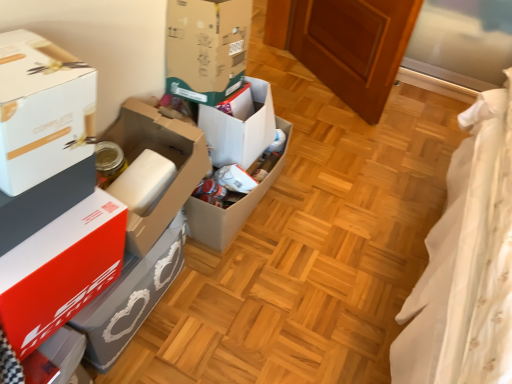
The height and width of the screenshot is (384, 512). What are the coordinates of `cardboard box at center, the 4th box from the front` in the screenshot? It's located at (206, 48).

Find the location of a particular element. This screenshot has width=512, height=384. white cardboard box at left, the sixth box from the back is located at coordinates (42, 110).

This screenshot has width=512, height=384. Describe the element at coordinates (42, 110) in the screenshot. I see `white cardboard box at left, the sixth box from the back` at that location.

Describe the element at coordinates (225, 214) in the screenshot. I see `cardboard box at center, the fifth box when ordered from front to back` at that location.

At what (x,y) coordinates should I click in order to perform the action: click on white cardboard box at left, which is the 4th box from back to front. Please return your answer as a coordinate pair (x, y). This screenshot has height=384, width=512. Looking at the image, I should click on (166, 157).

Between red matte box at left, the second box in the front-to-back sequence, and white cardboard box at left, which is the 4th box from back to front, which one is positioned behind?

white cardboard box at left, which is the 4th box from back to front, is behind.

In the scene shown: Is red matte box at left, arranged as the 5th box when viewed from the back, facing towards white cardboard box at left, positioned as the 3th box in front-to-back order?

No, red matte box at left, arranged as the 5th box when viewed from the back, is not aimed at white cardboard box at left, positioned as the 3th box in front-to-back order.

Which of these two, red matte box at left, arranged as the 5th box when viewed from the back, or white cardboard box at left, positioned as the 3th box in front-to-back order, stands taller?

red matte box at left, arranged as the 5th box when viewed from the back, is taller.

Are red matte box at left, the second box in the front-to-back sequence, and white cardboard box at left, positioned as the 3th box in front-to-back order, making contact?

No, red matte box at left, the second box in the front-to-back sequence, is not making contact with white cardboard box at left, positioned as the 3th box in front-to-back order.

Which is behind, cardboard box at center, the fifth box when ordered from front to back, or white cardboard box at left, positioned as the 3th box in front-to-back order?

cardboard box at center, the fifth box when ordered from front to back.

In terms of size, does cardboard box at center, placed as the second box when sorted from back to front, appear bigger or smaller than white cardboard box at left, positioned as the 3th box in front-to-back order?

Considering their sizes, cardboard box at center, placed as the second box when sorted from back to front, takes up more space than white cardboard box at left, positioned as the 3th box in front-to-back order.

Is cardboard box at center, the fifth box when ordered from front to back, looking in the opposite direction of white cardboard box at left, which is the 4th box from back to front?

No, cardboard box at center, the fifth box when ordered from front to back, is not facing the opposite direction of white cardboard box at left, which is the 4th box from back to front.

Is red matte box at left, the second box in the front-to-back sequence, oriented towards white cardboard box at left, the sixth box from the back?

No, red matte box at left, the second box in the front-to-back sequence, does not turn towards white cardboard box at left, the sixth box from the back.

Does point (36, 270) appear closer or farther from the camera than point (60, 109)?

Point (36, 270) is positioned farther from the camera compared to point (60, 109).

What are the coordinates of `the 1st box behind when counting from the white cardboard box at left, which is counted as the first box, starting from the front` in the screenshot? It's located at (60, 270).

Looking at their sizes, would you say red matte box at left, arranged as the 5th box when viewed from the back, is wider or thinner than white cardboard box at left, which is counted as the first box, starting from the front?

Clearly, red matte box at left, arranged as the 5th box when viewed from the back, has more width compared to white cardboard box at left, which is counted as the first box, starting from the front.

How many degrees apart are the facing directions of red matte box at left, arranged as the 5th box when viewed from the back, and cardboard box at center, placed as the second box when sorted from back to front?

There is a 3.5-degree angle between the facing directions of red matte box at left, arranged as the 5th box when viewed from the back, and cardboard box at center, placed as the second box when sorted from back to front.

Considering the sizes of objects red matte box at left, the second box in the front-to-back sequence, and cardboard box at center, the fifth box when ordered from front to back, in the image provided, who is bigger, red matte box at left, the second box in the front-to-back sequence, or cardboard box at center, the fifth box when ordered from front to back,?

cardboard box at center, the fifth box when ordered from front to back, is bigger.

From the image's perspective, does red matte box at left, arranged as the 5th box when viewed from the back, appear lower than cardboard box at center, the fifth box when ordered from front to back?

Yes.

In the image, is red matte box at left, arranged as the 5th box when viewed from the back, positioned in front of or behind cardboard box at center, the fifth box when ordered from front to back?

Visually, red matte box at left, arranged as the 5th box when viewed from the back, is located in front of cardboard box at center, the fifth box when ordered from front to back.

Considering the sizes of objects red matte box at left, the second box in the front-to-back sequence, and white cardboard box at center, arranged as the sixth box when viewed from the front, in the image provided, who is shorter, red matte box at left, the second box in the front-to-back sequence, or white cardboard box at center, arranged as the sixth box when viewed from the front,?

white cardboard box at center, arranged as the sixth box when viewed from the front, is shorter.

Considering the relative sizes of red matte box at left, the second box in the front-to-back sequence, and white cardboard box at center, arranged as the sixth box when viewed from the front, in the image provided, is red matte box at left, the second box in the front-to-back sequence, thinner than white cardboard box at center, arranged as the sixth box when viewed from the front,?

No.

What's the angular difference between red matte box at left, arranged as the 5th box when viewed from the back, and white cardboard box at center, arranged as the sixth box when viewed from the front,'s facing directions?

2.42 degrees separate the facing orientations of red matte box at left, arranged as the 5th box when viewed from the back, and white cardboard box at center, arranged as the sixth box when viewed from the front.

Could you tell me if red matte box at left, arranged as the 5th box when viewed from the back, is turned towards white cardboard box at center, arranged as the first box when viewed from the back?

No, red matte box at left, arranged as the 5th box when viewed from the back, does not turn towards white cardboard box at center, arranged as the first box when viewed from the back.

Which is more to the left, white cardboard box at left, the sixth box from the back, or red matte box at left, the second box in the front-to-back sequence?

red matte box at left, the second box in the front-to-back sequence, is more to the left.

Is white cardboard box at left, which is counted as the first box, starting from the front, oriented away from red matte box at left, the second box in the front-to-back sequence?

No, white cardboard box at left, which is counted as the first box, starting from the front,'s orientation is not away from red matte box at left, the second box in the front-to-back sequence.

Considering the sizes of objects white cardboard box at left, which is counted as the first box, starting from the front, and red matte box at left, the second box in the front-to-back sequence, in the image provided, who is smaller, white cardboard box at left, which is counted as the first box, starting from the front, or red matte box at left, the second box in the front-to-back sequence,?

white cardboard box at left, which is counted as the first box, starting from the front.

From a real-world perspective, is white cardboard box at left, which is counted as the first box, starting from the front, below red matte box at left, the second box in the front-to-back sequence?

Actually, white cardboard box at left, which is counted as the first box, starting from the front, is physically above red matte box at left, the second box in the front-to-back sequence, in the real world.

Does cardboard box at center, marked as the third box in a back-to-front arrangement, touch white cardboard box at left, the sixth box from the back?

No, cardboard box at center, marked as the third box in a back-to-front arrangement, is not making contact with white cardboard box at left, the sixth box from the back.

Which object is thinner, cardboard box at center, the 4th box from the front, or white cardboard box at left, the sixth box from the back?

With smaller width is white cardboard box at left, the sixth box from the back.

Could you measure the distance between cardboard box at center, the 4th box from the front, and white cardboard box at left, which is counted as the first box, starting from the front?

cardboard box at center, the 4th box from the front, and white cardboard box at left, which is counted as the first box, starting from the front, are 27.55 inches apart.

In terms of height, does cardboard box at center, marked as the third box in a back-to-front arrangement, look taller or shorter compared to white cardboard box at left, the sixth box from the back?

cardboard box at center, marked as the third box in a back-to-front arrangement, is taller than white cardboard box at left, the sixth box from the back.

You are a GUI agent. You are given a task and a screenshot of the screen. Output one action in this format:
    pyautogui.click(x=<x>, y=<y>)
    Task: Click on the 2nd box counting from the right of the red matte box at left, the second box in the front-to-back sequence
    
    Given the screenshot: What is the action you would take?
    pyautogui.click(x=166, y=157)

Where is `the 2nd box behind the white cardboard box at left, positioned as the 3th box in front-to-back order, starting your count from the anchor`? the 2nd box behind the white cardboard box at left, positioned as the 3th box in front-to-back order, starting your count from the anchor is located at coordinates (225, 214).

In the scene shown: Based on their spatial positions, is red matte box at left, the second box in the front-to-back sequence, or cardboard box at center, the fifth box when ordered from front to back, closer to white cardboard box at center, arranged as the first box when viewed from the back?

Among the two, cardboard box at center, the fifth box when ordered from front to back, is located nearer to white cardboard box at center, arranged as the first box when viewed from the back.

Looking at the image, which one is located further to white cardboard box at center, arranged as the sixth box when viewed from the front, white cardboard box at left, the sixth box from the back, or white cardboard box at left, which is the 4th box from back to front?

Based on the image, white cardboard box at left, the sixth box from the back, appears to be further to white cardboard box at center, arranged as the sixth box when viewed from the front.

Considering their positions, is cardboard box at center, the fifth box when ordered from front to back, positioned further to red matte box at left, the second box in the front-to-back sequence, than cardboard box at center, the 4th box from the front?

Among the two, cardboard box at center, the 4th box from the front, is located further to red matte box at left, the second box in the front-to-back sequence.

When comparing their distances from white cardboard box at left, which is the 4th box from back to front, does cardboard box at center, the 4th box from the front, or white cardboard box at center, arranged as the sixth box when viewed from the front, seem closer?

white cardboard box at center, arranged as the sixth box when viewed from the front, lies closer to white cardboard box at left, which is the 4th box from back to front, than the other object.

Based on their spatial positions, is cardboard box at center, placed as the second box when sorted from back to front, or white cardboard box at left, positioned as the 3th box in front-to-back order, further from white cardboard box at center, arranged as the first box when viewed from the back?

Based on the image, white cardboard box at left, positioned as the 3th box in front-to-back order, appears to be further to white cardboard box at center, arranged as the first box when viewed from the back.

When comparing their distances from white cardboard box at left, which is counted as the first box, starting from the front, does cardboard box at center, the fifth box when ordered from front to back, or cardboard box at center, marked as the third box in a back-to-front arrangement, seem further?

cardboard box at center, the fifth box when ordered from front to back, lies further to white cardboard box at left, which is counted as the first box, starting from the front, than the other object.

Looking at the image, which one is located closer to white cardboard box at left, which is counted as the first box, starting from the front, red matte box at left, arranged as the 5th box when viewed from the back, or white cardboard box at left, positioned as the 3th box in front-to-back order?

red matte box at left, arranged as the 5th box when viewed from the back, is closer to white cardboard box at left, which is counted as the first box, starting from the front.

Estimate the real-world distances between objects in this image. Which object is closer to red matte box at left, arranged as the 5th box when viewed from the back, cardboard box at center, marked as the third box in a back-to-front arrangement, or white cardboard box at left, positioned as the 3th box in front-to-back order?

The object closer to red matte box at left, arranged as the 5th box when viewed from the back, is white cardboard box at left, positioned as the 3th box in front-to-back order.

This screenshot has height=384, width=512. In order to click on box between white cardboard box at left, the sixth box from the back, and white cardboard box at left, positioned as the 3th box in front-to-back order, along the z-axis in this screenshot , I will do `click(60, 270)`.